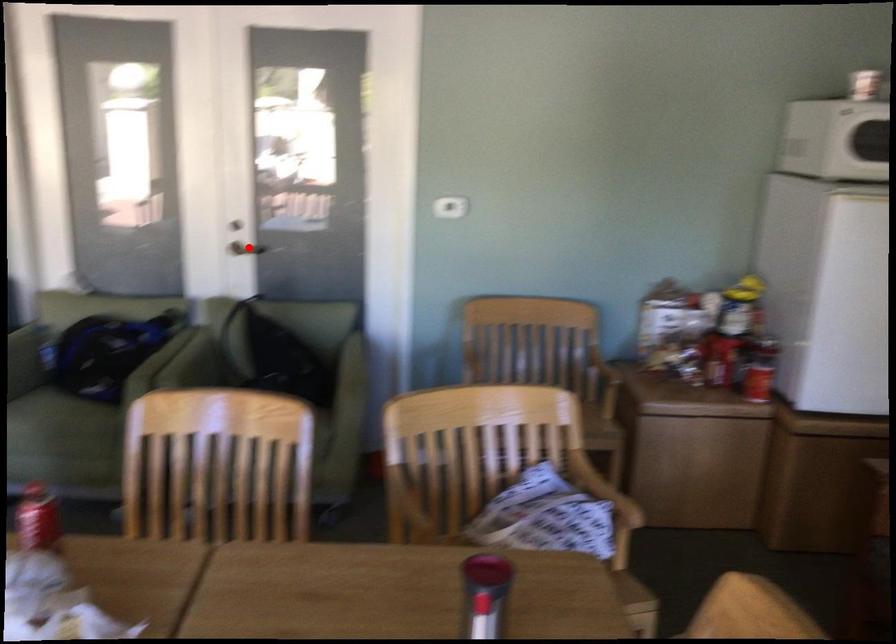
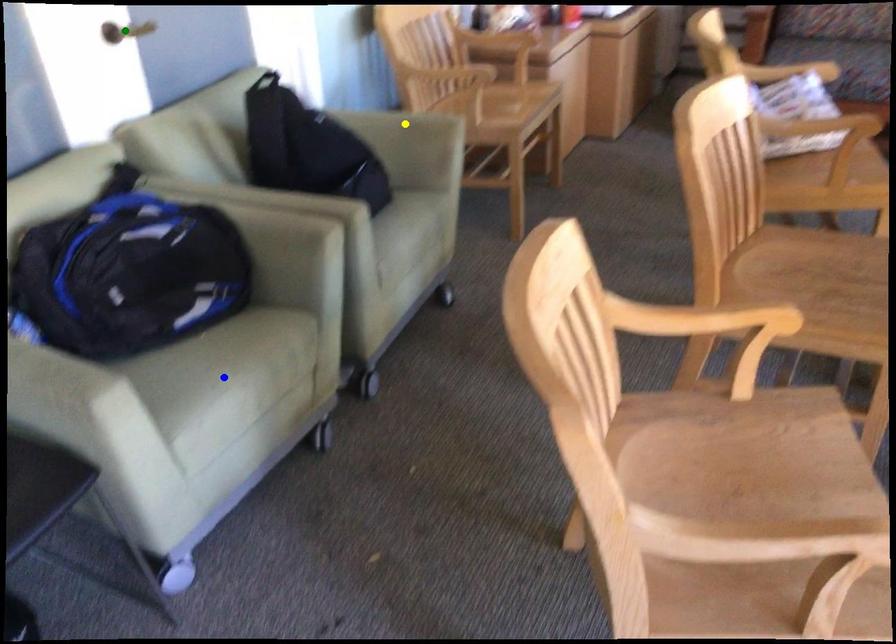
Question: I am providing you with two images of the same scene from different viewpoints. A red point is marked on the first image. You are given multiple points on the second image. Which spot in image 2 lines up with the point in image 1?

Choices:
 (A) yellow point
 (B) blue point
 (C) green point

Answer: (C)